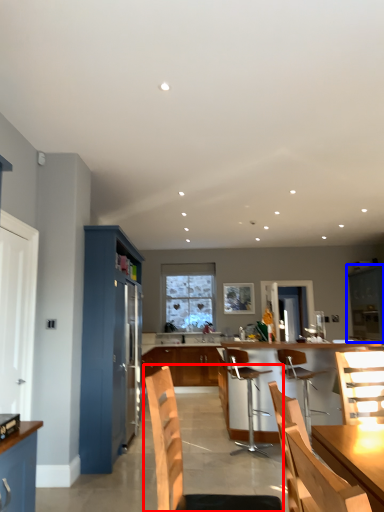
Question: Which of the following is the farthest to the observer, chair (highlighted by a red box) or cabinetry (highlighted by a blue box)?

Choices:
 (A) chair
 (B) cabinetry

Answer: (B)